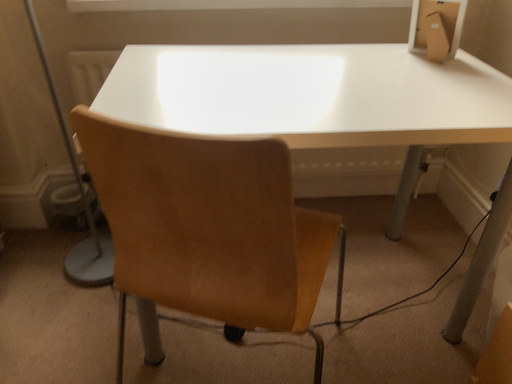
Question: From a real-world perspective, is white glossy table at center positioned above or below light brown leather chair at center?

Choices:
 (A) above
 (B) below

Answer: (B)

Question: Looking at their shapes, would you say white glossy table at center is wider or thinner than light brown leather chair at center?

Choices:
 (A) wide
 (B) thin

Answer: (A)

Question: Based on their relative distances, which object is nearer to the matte gray table lamp at left?

Choices:
 (A) light brown leather chair at center
 (B) brown cardboard box at upper right
 (C) white glossy table at center
 (D) white matte window frame at upper center

Answer: (D)

Question: Based on their relative distances, which object is nearer to the light brown leather chair at center?

Choices:
 (A) white glossy table at center
 (B) white matte window frame at upper center
 (C) matte gray table lamp at left
 (D) brown cardboard box at upper right

Answer: (A)